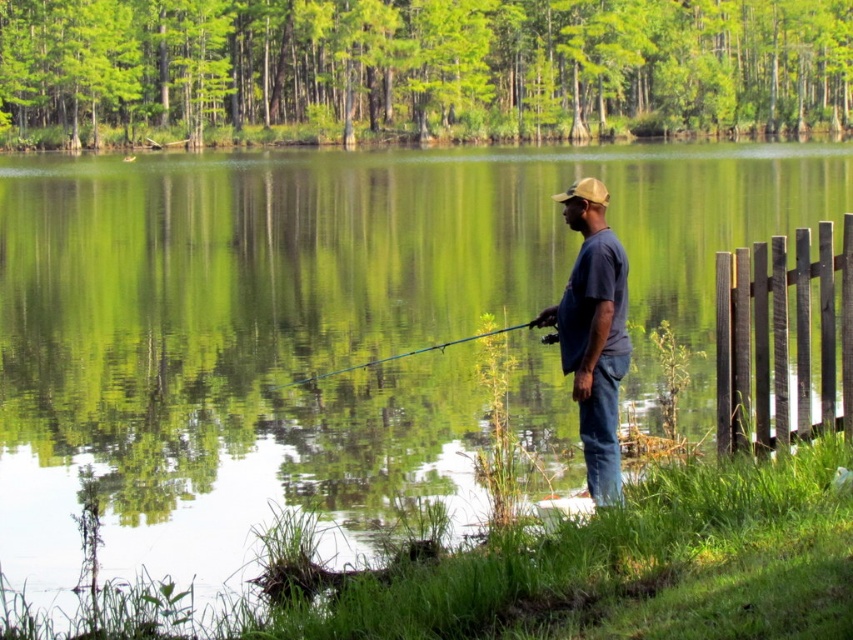
You are standing at the point with coordinates point (x=779, y=348) and want to walk towards the point with coordinates point (x=495, y=330). Which direction should you move to reach your destination?

You should move backward because point (x=779, y=348) is in front of point (x=495, y=330), so moving backward will take you toward the desired point.

You are standing on the lakeside and see the brown wooden fence at right and the blue cotton shirt at center. Which object is closer to you?

The brown wooden fence at right is closer to you because it is further to the viewer than the blue cotton shirt at center.